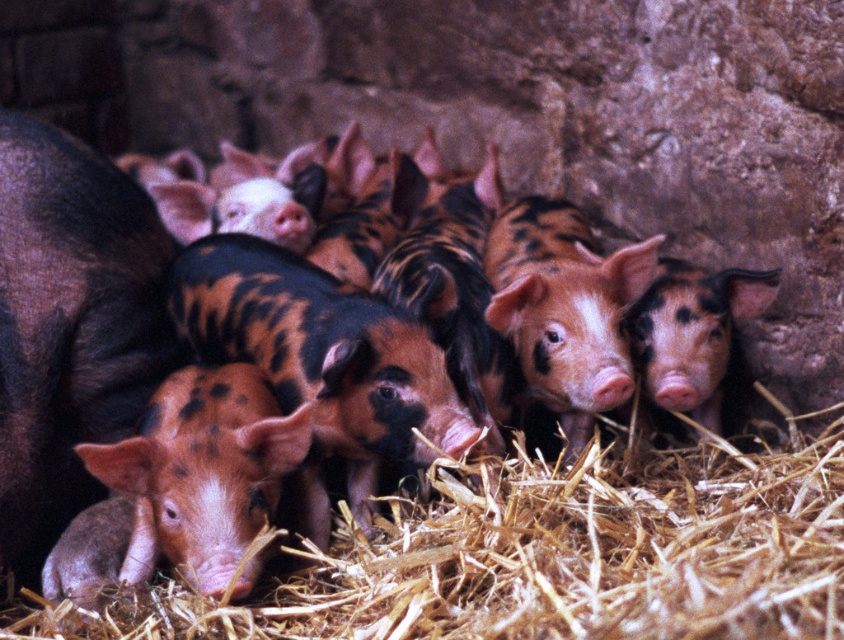
Question: Which point is closer to the camera?

Choices:
 (A) spotted pink piglet at center
 (B) brown straw at lower left

Answer: (B)

Question: Does brown straw at lower left have a larger size compared to spotted pink piglet at center?

Choices:
 (A) yes
 (B) no

Answer: (B)

Question: Among these objects, which one is nearest to the camera?

Choices:
 (A) spotted pink piglet at center
 (B) brown straw at lower left

Answer: (B)

Question: Does brown straw at lower left appear under spotted pink piglet at center?

Choices:
 (A) yes
 (B) no

Answer: (A)

Question: Does brown straw at lower left have a greater width compared to spotted pink piglet at center?

Choices:
 (A) yes
 (B) no

Answer: (B)

Question: Among these points, which one is farthest from the camera?

Choices:
 (A) (740, 474)
 (B) (695, 356)

Answer: (B)